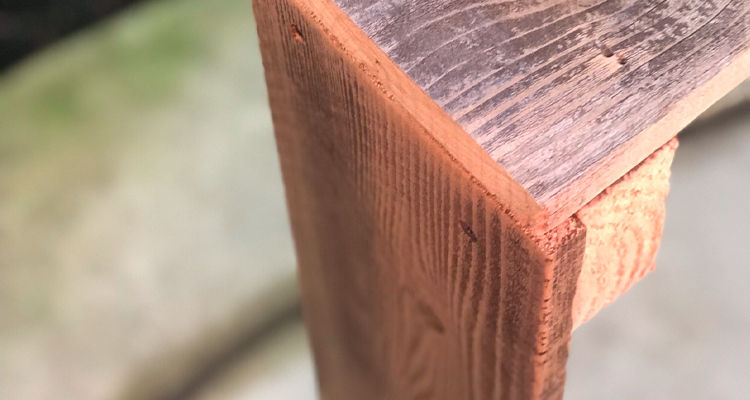
At what (x,y) coordinates should I click in order to perform the action: click on wooden piece to reinforce corner. Please return your answer as a coordinate pair (x, y). Looking at the image, I should click on (618, 226).